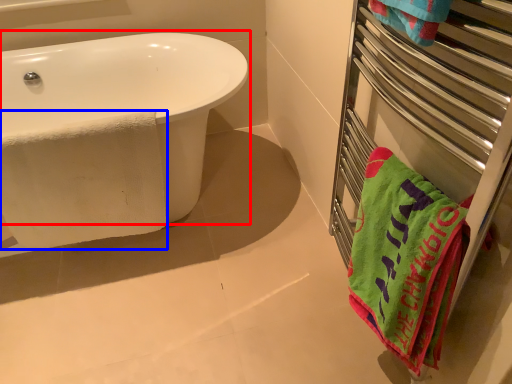
Question: Which object is closer to the camera taking this photo, bathtub (highlighted by a red box) or beach towel (highlighted by a blue box)?

Choices:
 (A) bathtub
 (B) beach towel

Answer: (A)